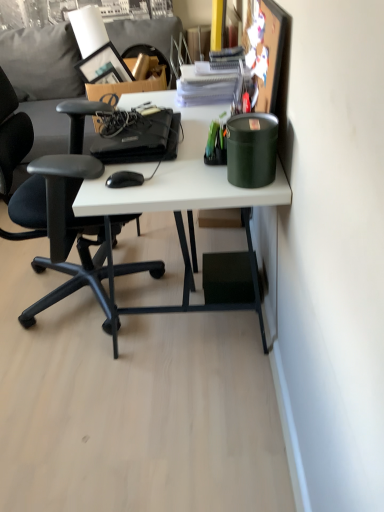
At what (x,y) coordinates should I click in order to perform the action: click on free area in between black plastic mouse at center and black matte laptop at center. Please return your answer as a coordinate pair (x, y). This screenshot has width=384, height=512. Looking at the image, I should click on (139, 168).